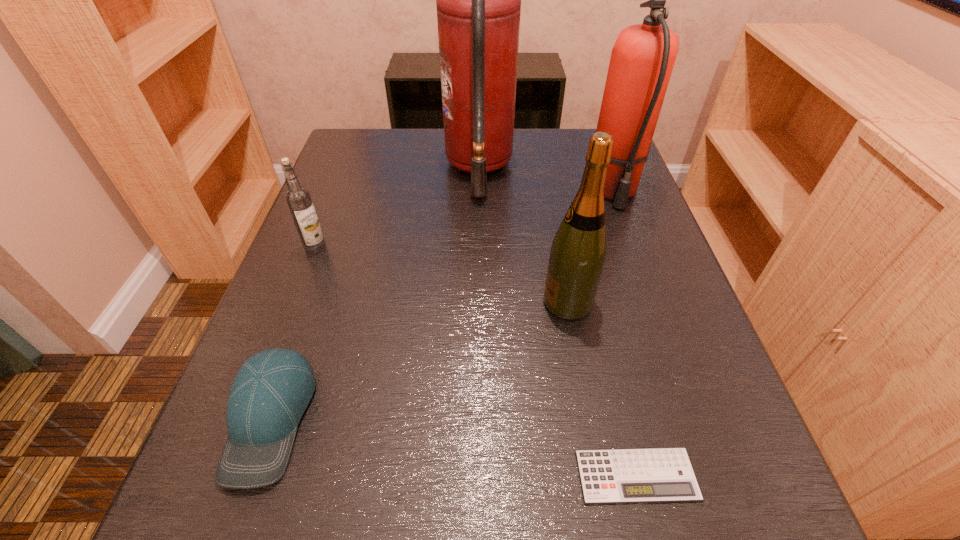
Locate an element on the screen. vacant area between the third shortest object and the third nearest object is located at coordinates (442, 275).

Where is `empty location between the baseball cap and the fourth nearest object`? empty location between the baseball cap and the fourth nearest object is located at coordinates (293, 333).

The image size is (960, 540). I want to click on object that can be found as the closest to the left fire extinguisher, so click(x=642, y=59).

Locate an element on the screen. The height and width of the screenshot is (540, 960). the second closest object relative to the fourth nearest object is located at coordinates (478, 0).

Identify the location of vacant position in the image that satisfies the following two spatial constraints: 1. on the label of the baseball cap; 2. on the left side of the fourth nearest object. (250, 419).

Identify the location of vacant space that satisfies the following two spatial constraints: 1. at the front of the fourth object from right to left where the nozzle is aimed; 2. on the left side of the shortest object. (478, 475).

At what (x,y) coordinates should I click in order to perform the action: click on free spot that satisfies the following two spatial constraints: 1. on the label of the shortest object; 2. on the left side of the fourth tallest object. Please return your answer as a coordinate pair (x, y). Looking at the image, I should click on (228, 475).

Locate an element on the screen. vacant point that satisfies the following two spatial constraints: 1. on the label of the fifth tallest object; 2. on the left side of the third farthest object is located at coordinates (250, 419).

Locate an element on the screen. vacant space that satisfies the following two spatial constraints: 1. at the front of the left fire extinguisher where the nozzle is aimed; 2. on the right side of the shortest object is located at coordinates (478, 475).

Where is `vacant point that satisfies the following two spatial constraints: 1. on the back side of the shortest object; 2. at the front of the third object from left to right where the nozzle is aimed`? The height and width of the screenshot is (540, 960). vacant point that satisfies the following two spatial constraints: 1. on the back side of the shortest object; 2. at the front of the third object from left to right where the nozzle is aimed is located at coordinates (564, 168).